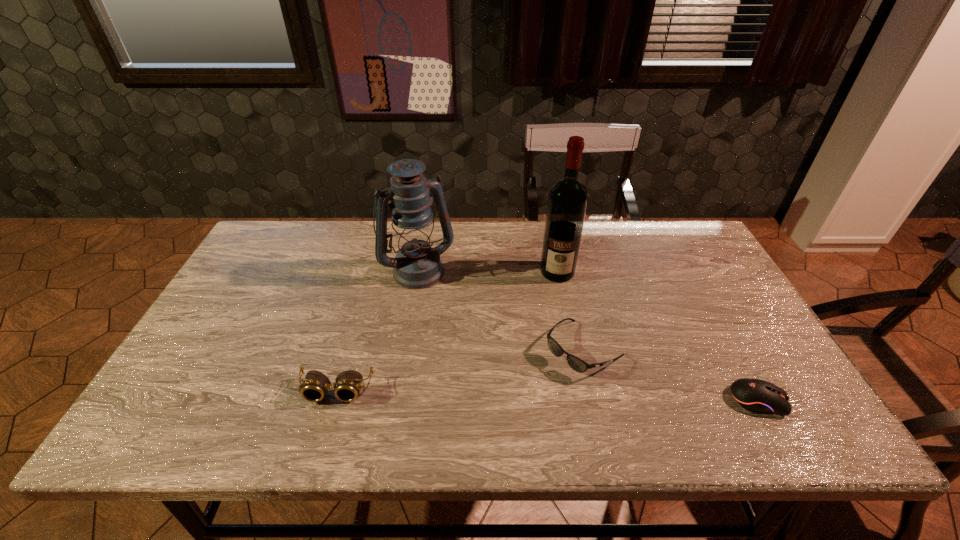
Where is `free space between the alcohol and the second tallest object`? This screenshot has width=960, height=540. free space between the alcohol and the second tallest object is located at coordinates 488,270.

The image size is (960, 540). I want to click on vacant area between the fourth shortest object and the goggles, so click(377, 329).

Image resolution: width=960 pixels, height=540 pixels. I want to click on free space between the alcohol and the rightmost object, so click(658, 336).

At what (x,y) coordinates should I click in order to perform the action: click on free area in between the alcohol and the sunglasses. Please return your answer as a coordinate pair (x, y). The height and width of the screenshot is (540, 960). Looking at the image, I should click on (570, 310).

This screenshot has width=960, height=540. I want to click on empty space between the sunglasses and the alcohol, so pos(570,310).

Find the location of a particular element. vacant area that lies between the rightmost object and the goggles is located at coordinates (547, 395).

Locate an element on the screen. vacant region between the fourth shortest object and the shortest object is located at coordinates (588, 334).

Where is `vacant space in between the alcohol and the sunglasses`? vacant space in between the alcohol and the sunglasses is located at coordinates (570, 310).

Find the location of a particular element. object that is the fourth nearest to the sunglasses is located at coordinates (315, 387).

Where is `the fourth closest object relative to the computer mouse`? the fourth closest object relative to the computer mouse is located at coordinates (315, 387).